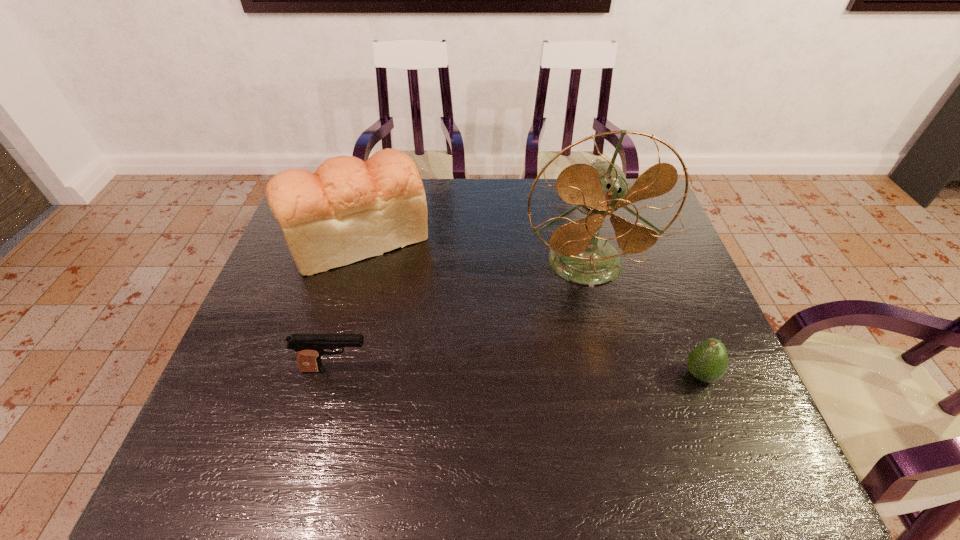
Image resolution: width=960 pixels, height=540 pixels. What are the coordinates of `object that is the third nearest to the pistol` in the screenshot? It's located at (707, 362).

You are a GUI agent. You are given a task and a screenshot of the screen. Output one action in this format:
    pyautogui.click(x=<x>, y=<y>)
    Task: Click on the third closest object to the bread
    This screenshot has width=960, height=540.
    Given the screenshot: What is the action you would take?
    pyautogui.click(x=707, y=362)

At what (x,y) coordinates should I click in order to perform the action: click on vacant area that satisfies the following two spatial constraints: 1. at the barrel of the pistol; 2. on the right side of the avocado. Please return your answer as a coordinate pair (x, y). Looking at the image, I should click on (335, 375).

Locate an element on the screen. The width and height of the screenshot is (960, 540). free space that satisfies the following two spatial constraints: 1. in front of the avocado, directing air flow; 2. on the left side of the fan is located at coordinates (612, 375).